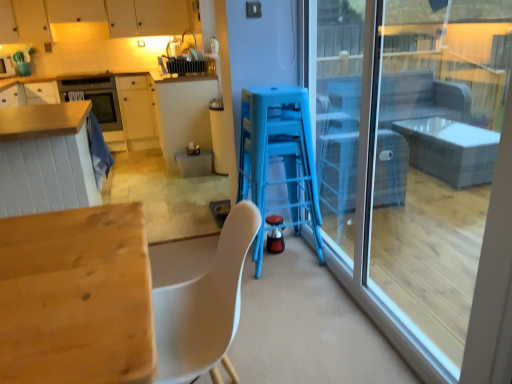
Question: Is shiny black kettle at center, the first appliance when ordered from front to back, facing towards matte wood cabinetry at left, the 1th cabinetry from the bottom?

Choices:
 (A) yes
 (B) no

Answer: (B)

Question: Can you confirm if shiny black kettle at center, the first appliance in the bottom-to-top sequence, is positioned to the right of matte wood cabinetry at left, the 1th cabinetry from the bottom?

Choices:
 (A) yes
 (B) no

Answer: (A)

Question: From the image's perspective, would you say shiny black kettle at center, the first appliance in the bottom-to-top sequence, is positioned over matte wood cabinetry at left, which is the second cabinetry in top-to-bottom order?

Choices:
 (A) no
 (B) yes

Answer: (A)

Question: Are shiny black kettle at center, the 2th appliance viewed from the left, and matte wood cabinetry at left, which is the second cabinetry in top-to-bottom order, far apart?

Choices:
 (A) yes
 (B) no

Answer: (A)

Question: Is shiny black kettle at center, the 2th appliance viewed from the left, positioned before matte wood cabinetry at left, the 1th cabinetry from the bottom?

Choices:
 (A) yes
 (B) no

Answer: (A)

Question: From a real-world perspective, is shiny black kettle at center, the first appliance when ordered from front to back, positioned under matte wood cabinetry at left, the 1th cabinetry from the bottom, based on gravity?

Choices:
 (A) no
 (B) yes

Answer: (B)

Question: From a real-world perspective, is blue plastic bar stool at center below shiny black kettle at center, the 1th appliance when ordered from right to left?

Choices:
 (A) no
 (B) yes

Answer: (A)

Question: Is blue plastic bar stool at center in front of shiny black kettle at center, acting as the 2th appliance starting from the back?

Choices:
 (A) no
 (B) yes

Answer: (B)

Question: Is there a large distance between blue plastic bar stool at center and shiny black kettle at center, acting as the 2th appliance starting from the back?

Choices:
 (A) yes
 (B) no

Answer: (B)

Question: Can you confirm if blue plastic bar stool at center is thinner than shiny black kettle at center, the 1th appliance when ordered from right to left?

Choices:
 (A) yes
 (B) no

Answer: (B)

Question: Is blue plastic bar stool at center smaller than shiny black kettle at center, the first appliance in the bottom-to-top sequence?

Choices:
 (A) no
 (B) yes

Answer: (A)

Question: Is shiny black kettle at center, the first appliance in the bottom-to-top sequence, at the back of blue plastic bar stool at center?

Choices:
 (A) yes
 (B) no

Answer: (B)

Question: Is matte black oven at upper left surrounded by matte wood cabinetry at left, which is the second cabinetry in top-to-bottom order?

Choices:
 (A) no
 (B) yes

Answer: (B)